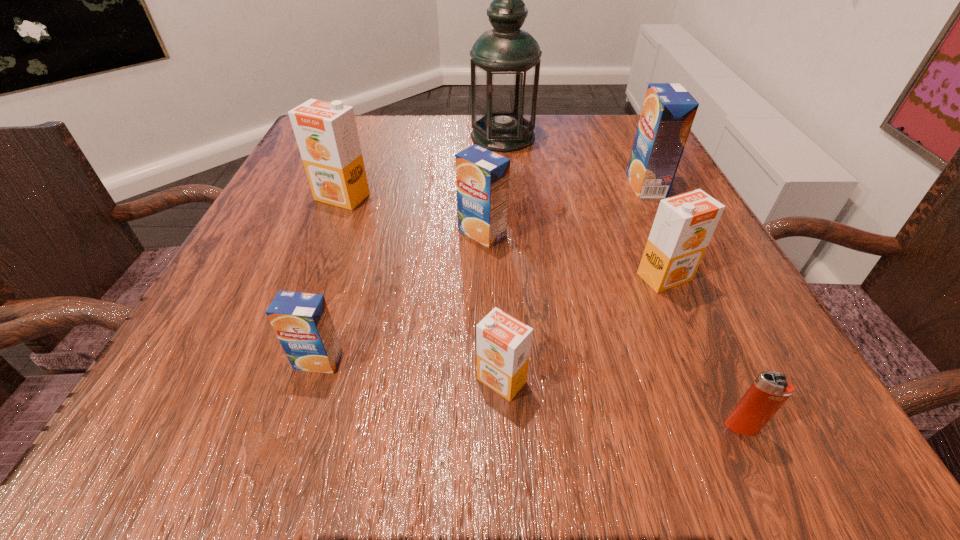
This screenshot has height=540, width=960. In order to click on the leftmost blue orange_juice in this screenshot , I will do `click(302, 322)`.

The image size is (960, 540). Find the location of `the smallest blue orange_juice`. the smallest blue orange_juice is located at coordinates (302, 322).

Locate an element on the screen. The height and width of the screenshot is (540, 960). the second orange orange juice from right to left is located at coordinates (503, 343).

The height and width of the screenshot is (540, 960). I want to click on the nearest orange orange juice, so click(503, 343).

Where is `igniter`? The width and height of the screenshot is (960, 540). igniter is located at coordinates (770, 390).

This screenshot has width=960, height=540. Find the location of `vacant space situated on the right of the farthest object`. vacant space situated on the right of the farthest object is located at coordinates (x=596, y=137).

This screenshot has width=960, height=540. I want to click on blank space located 0.290m on the right of the leftmost orange orange juice, so click(x=523, y=197).

Find the location of a particular element. vacant space located on the left of the rightmost blue orange_juice is located at coordinates (488, 186).

Where is `vacant space located 0.060m on the back of the second smallest blue orange_juice`? The height and width of the screenshot is (540, 960). vacant space located 0.060m on the back of the second smallest blue orange_juice is located at coordinates (482, 199).

Find the location of `vacant space located 0.150m on the front of the third nearest orange juice`. vacant space located 0.150m on the front of the third nearest orange juice is located at coordinates (709, 381).